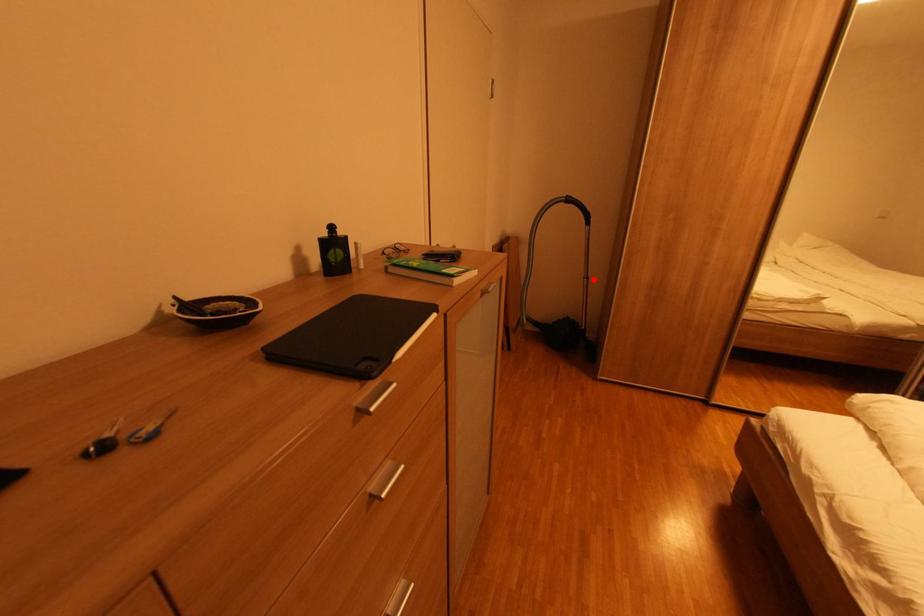
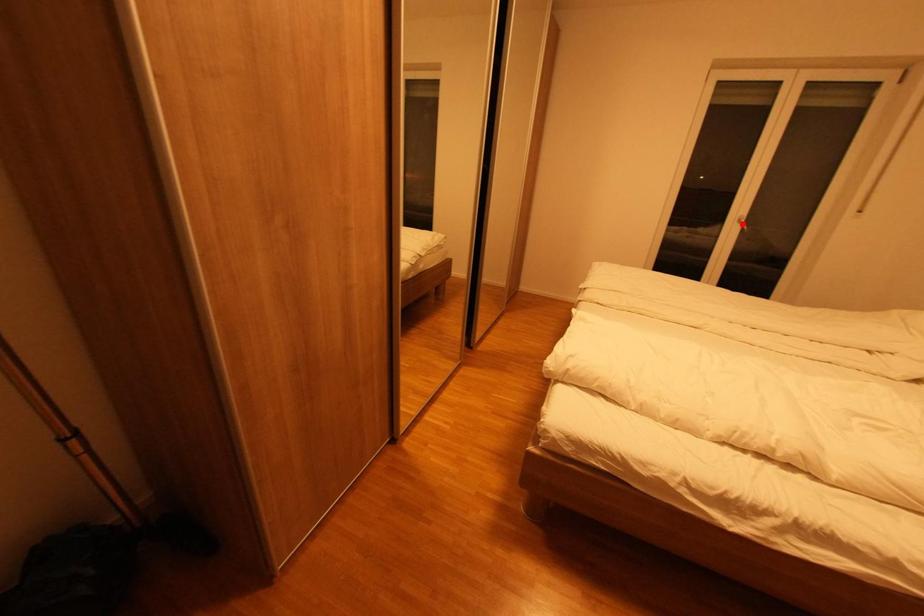
I am providing you with two images of the same scene from different viewpoints. A red point is marked on the first image and another point is marked on the second image. Is the marked point in image1 the same physical position as the marked point in image2?

No